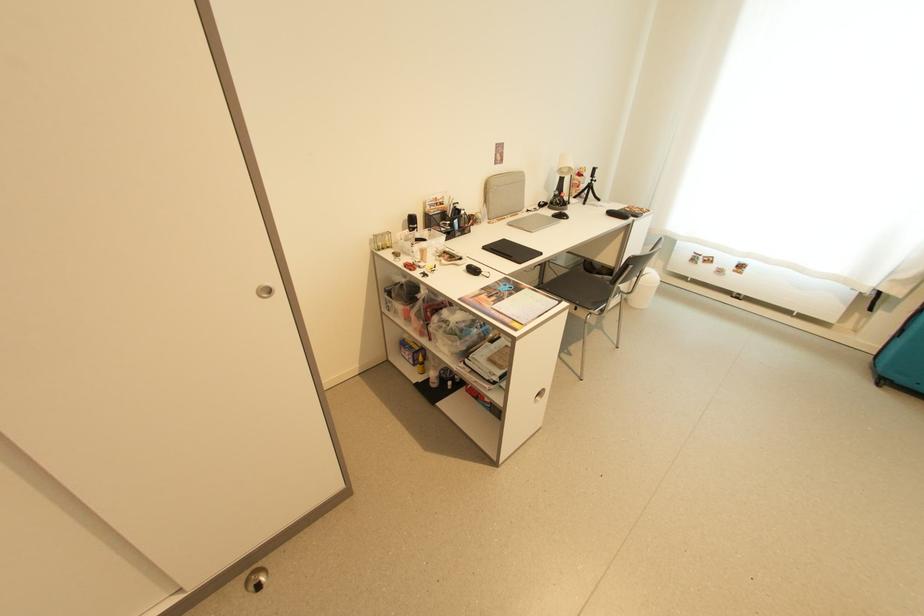
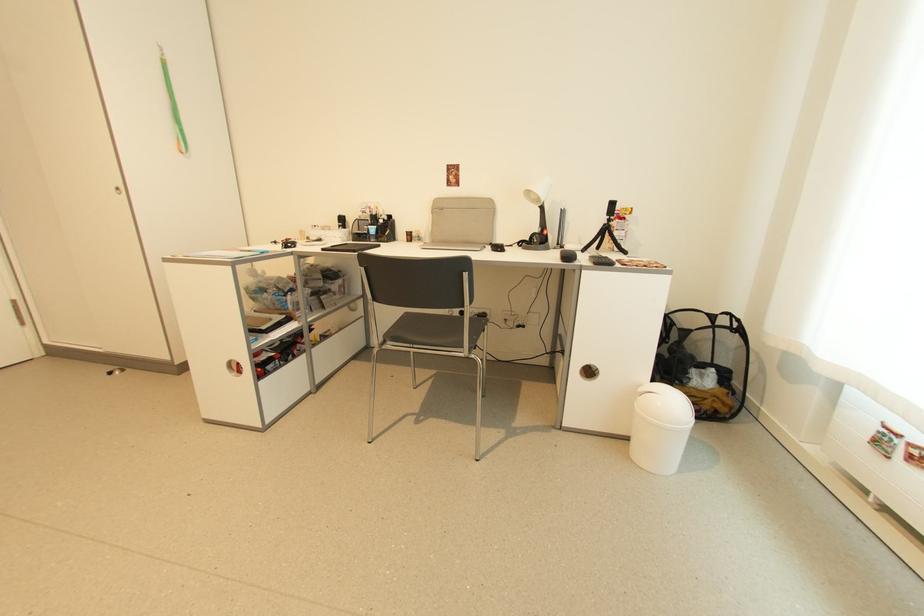
Where in the second image is the point corresponding to (597,179) from the first image?

(612, 217)